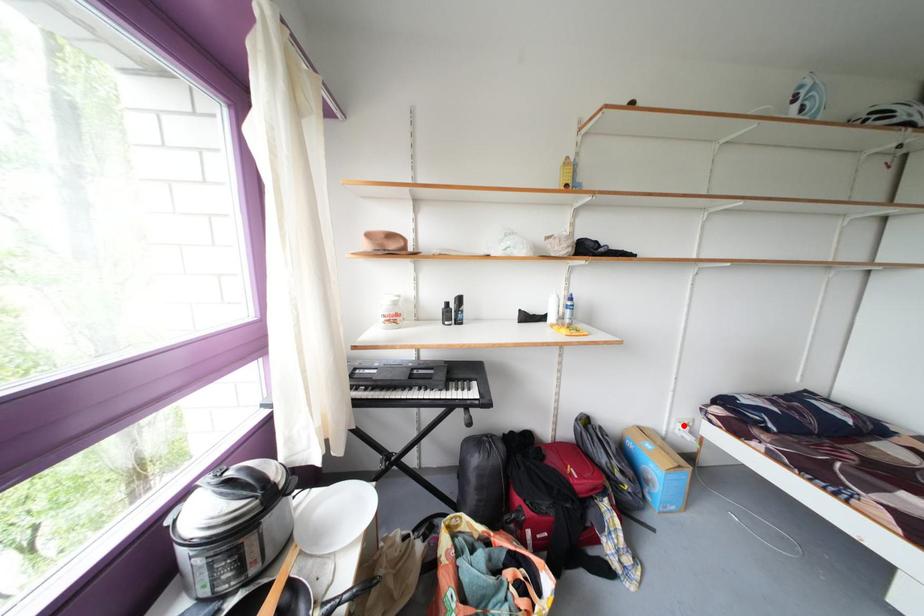
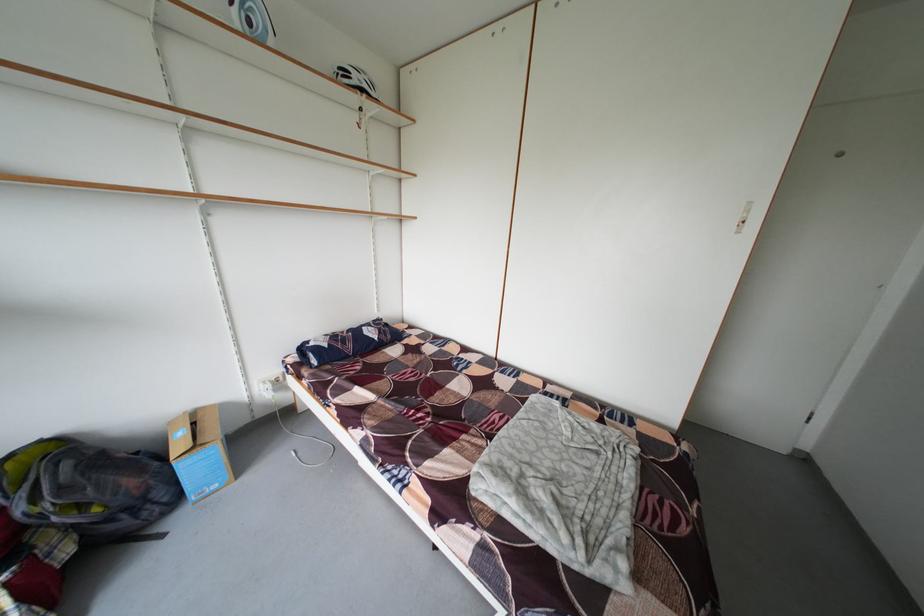
Where in the second image is the point corresponding to the highlighted location from the first image?

(265, 387)